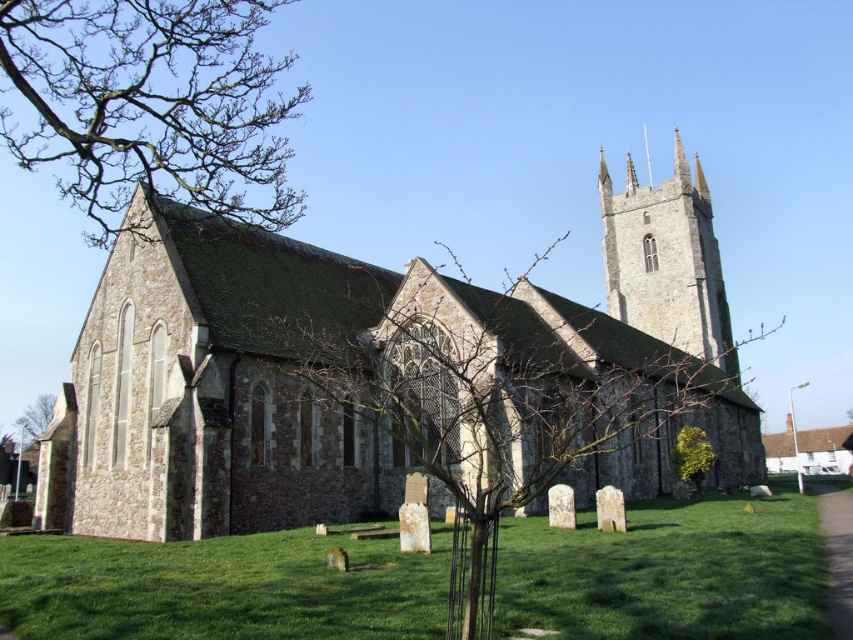
How distant is bare branches at upper left from green leafy tree at lower right?

bare branches at upper left is 117.08 meters from green leafy tree at lower right.

Can you confirm if bare branches at upper left is shorter than green leafy tree at lower right?

In fact, bare branches at upper left may be taller than green leafy tree at lower right.

The image size is (853, 640). I want to click on bare branches at upper left, so click(x=149, y=104).

Is stone church at center smaller than stone steeple at upper right?

Actually, stone church at center might be larger than stone steeple at upper right.

Find the location of `stone church at center`. stone church at center is located at coordinates (384, 376).

Who is more distant from viewer, (x=207, y=276) or (x=630, y=173)?

The point (x=630, y=173) is more distant.

The width and height of the screenshot is (853, 640). Identify the location of stone church at center. (384, 376).

Does green leafy tree at lower right have a lesser width compared to green leafy tree at lower left?

Correct, green leafy tree at lower right's width is less than green leafy tree at lower left's.

Does green leafy tree at lower right lie in front of green leafy tree at lower left?

Yes, green leafy tree at lower right is in front of green leafy tree at lower left.

The image size is (853, 640). Describe the element at coordinates (691, 456) in the screenshot. I see `green leafy tree at lower right` at that location.

Find the location of `green leafy tree at lower right`. green leafy tree at lower right is located at coordinates (691, 456).